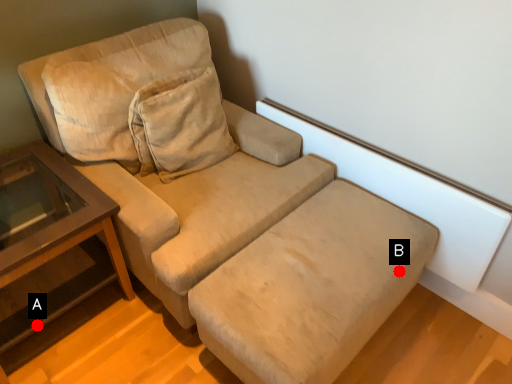
Question: Two points are circled on the image, labeled by A and B beside each circle. Which point is farther to the camera?

Choices:
 (A) A is further
 (B) B is further

Answer: (A)